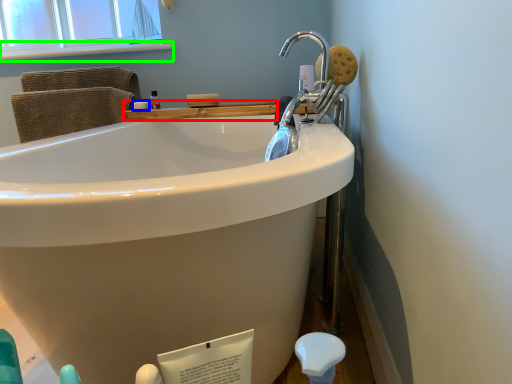
Question: Based on their relative distances, which object is farther from counter top (highlighted by a red box)? Choose from soap (highlighted by a blue box) and window sill (highlighted by a green box).

Choices:
 (A) soap
 (B) window sill

Answer: (B)